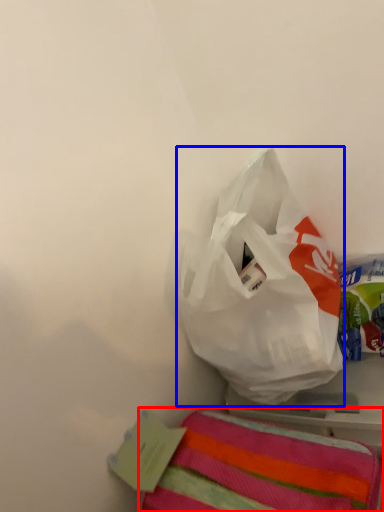
Question: Which of the following is the farthest to the observer, towel (highlighted by a red box) or plastic bag (highlighted by a blue box)?

Choices:
 (A) towel
 (B) plastic bag

Answer: (B)